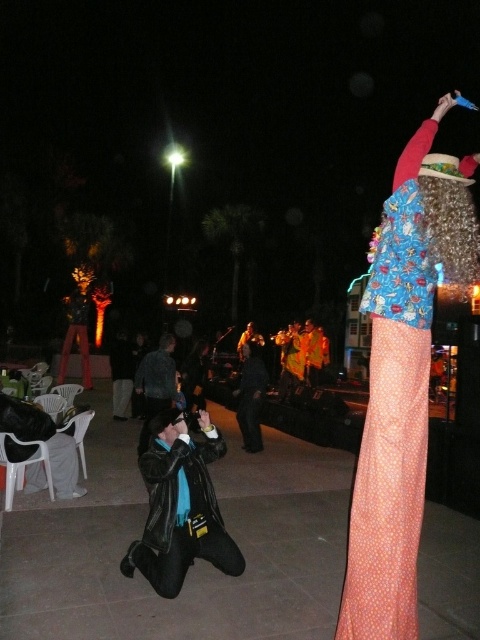
You are at the concert and want to take a photo of both the person in the colorful blue top and the group of musicians. Which of the two points, point (420, 186) or point (303, 353), is closer to you and should be focused on first to ensure both are in clear view?

Point (420, 186) is closer to the camera than point (303, 353). To ensure both are in clear view, focus on the closer point first.